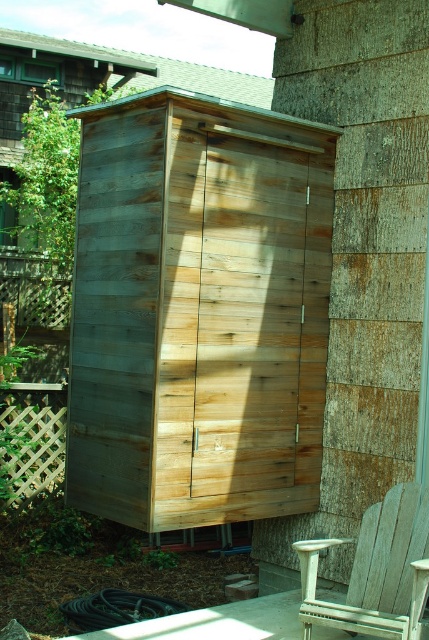
Measure the distance from weathered wood shed at center to green wood tree at upper left.

The distance of weathered wood shed at center from green wood tree at upper left is 9.80 meters.

Find the location of a particular element. The image size is (429, 640). weathered wood shed at center is located at coordinates (198, 310).

Locate an element on the screen. The height and width of the screenshot is (640, 429). weathered wood shed at center is located at coordinates (198, 310).

Does point (310, 605) come in front of point (68, 324)?

Yes, it is.

Does white weathered wood chair at lower right have a greater width compared to wooden lattice at left?

No, white weathered wood chair at lower right is not wider than wooden lattice at left.

Between point (405, 573) and point (42, 257), which one is positioned behind?

The point (42, 257) is more distant.

Find the location of a particular element. This screenshot has width=429, height=640. white weathered wood chair at lower right is located at coordinates (375, 570).

Can you confirm if green wood tree at upper left is shorter than white weathered wood chair at lower right?

Correct, green wood tree at upper left is not as tall as white weathered wood chair at lower right.

Between point (27, 243) and point (378, 556), which one is positioned in front?

Positioned in front is point (378, 556).

Identify the location of green wood tree at upper left. The image size is (429, 640). (45, 211).